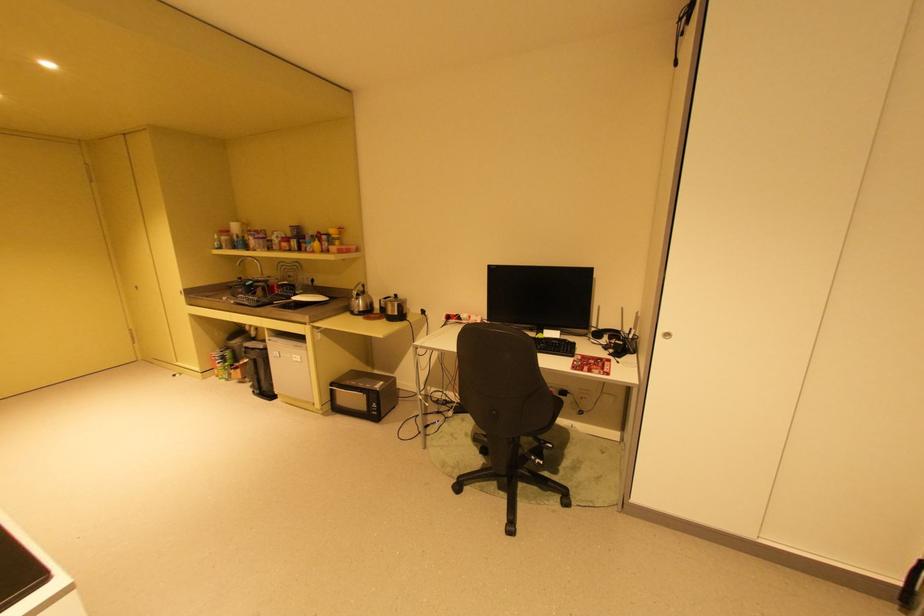
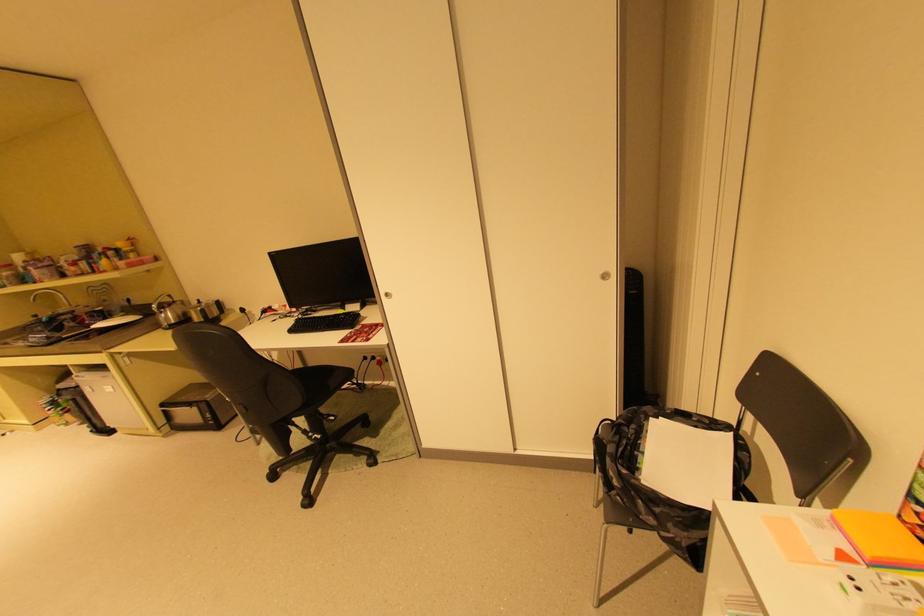
Find the pixel in the second image that matches pixel 359 371 in the first image.

(199, 385)